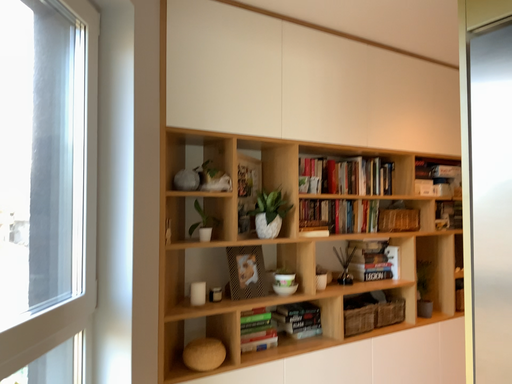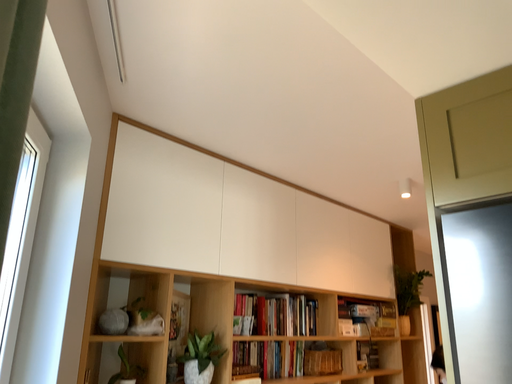
Question: How did the camera likely rotate when shooting the video?

Choices:
 (A) rotated left
 (B) rotated right

Answer: (B)